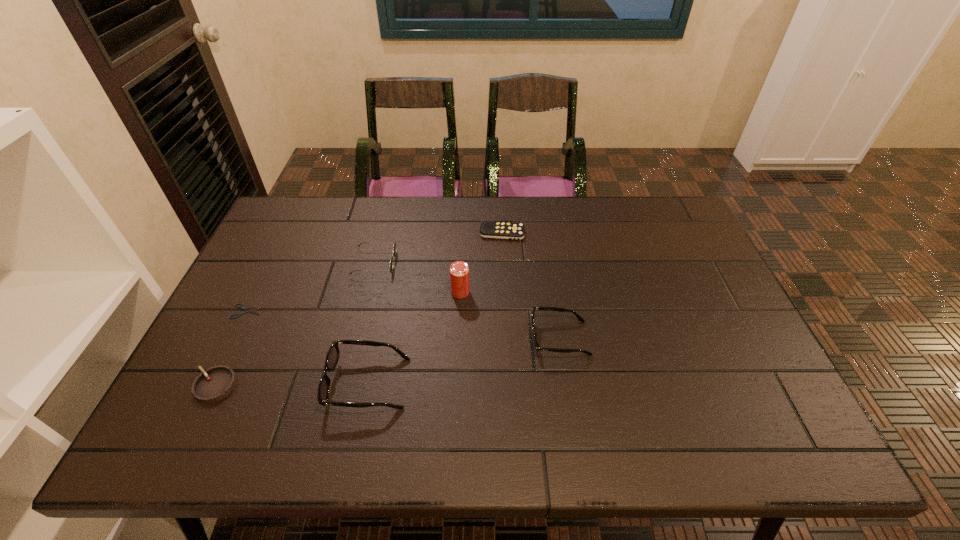
Please point out where to position a new spectacles on the right to maintain spacing. Please provide its 2D coordinates. Your answer should be formatted as a tuple, i.e. [(x, y)], where the tuple contains the x and y coordinates of a point satisfying the conditions above.

[(722, 300)]